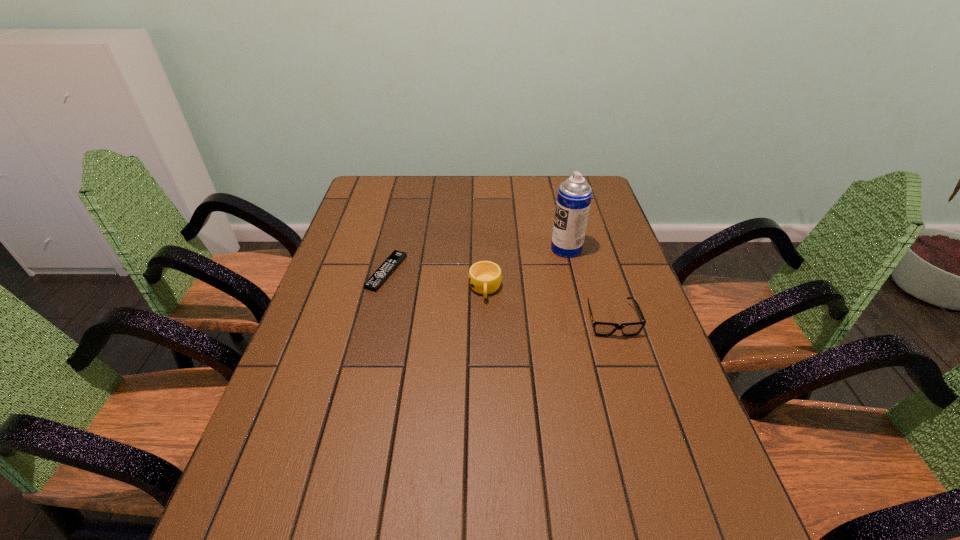
You are a GUI agent. You are given a task and a screenshot of the screen. Output one action in this format:
    pyautogui.click(x=<x>, y=<y>)
    Task: Click on the vacant space situated 0.400m on the front-facing side of the third tallest object
    
    Given the screenshot: What is the action you would take?
    pyautogui.click(x=668, y=504)

Identify the location of vacant position located on the back of the shortest object. (402, 208).

The image size is (960, 540). Identify the location of object that is at the left edge. (380, 276).

Identify the location of aerosol can that is at the right edge. (574, 196).

Identify the location of sunglasses that is at the right edge. (605, 329).

Image resolution: width=960 pixels, height=540 pixels. In order to click on vacant space at the far edge of the desktop in this screenshot , I will do `click(548, 208)`.

Where is `free location at the left edge`? Image resolution: width=960 pixels, height=540 pixels. free location at the left edge is located at coordinates (308, 391).

You are a GUI agent. You are given a task and a screenshot of the screen. Output one action in this format:
    pyautogui.click(x=<x>, y=<y>)
    Task: Click on the free location at the right edge of the desktop
    
    Given the screenshot: What is the action you would take?
    pyautogui.click(x=646, y=417)

At what (x,y) coordinates should I click in order to perform the action: click on free point at the far left corner. Please return your answer as a coordinate pair (x, y). Looking at the image, I should click on (372, 199).

In order to click on vacant space at the far right corner of the desktop in this screenshot , I will do `click(589, 181)`.